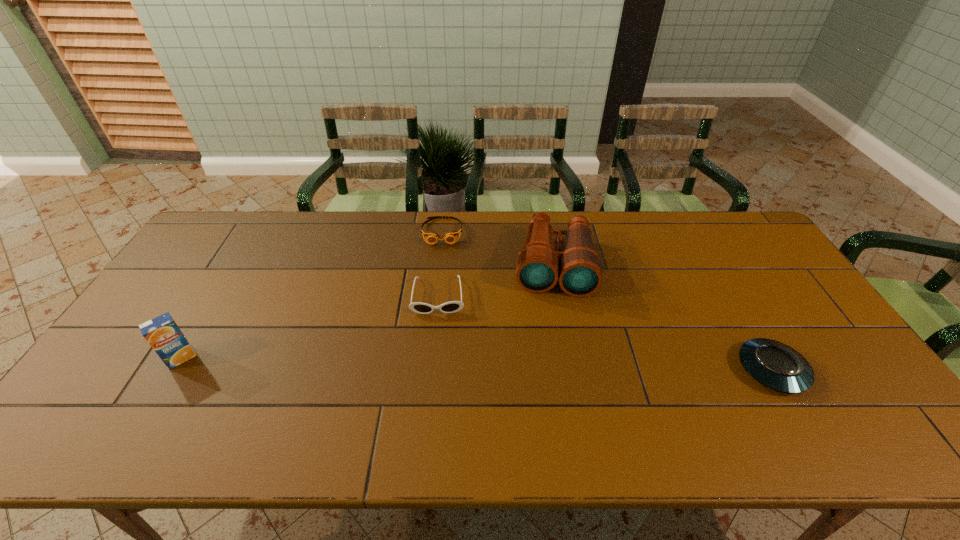
The width and height of the screenshot is (960, 540). Find the location of `vacant space on the desktop that is between the leftmost object and the rightmost object and is positioned through the lenses of the second object from right to left`. vacant space on the desktop that is between the leftmost object and the rightmost object and is positioned through the lenses of the second object from right to left is located at coordinates (549, 366).

I want to click on free space on the desktop that is between the orange_juice and the saucer and is positioned with the lenses facing forward on the goggles, so click(437, 363).

Locate an element on the screen. The image size is (960, 540). vacant spot on the desktop that is between the leftmost object and the saucer and is positioned with the lenses of the sunglasses facing outward is located at coordinates (437, 363).